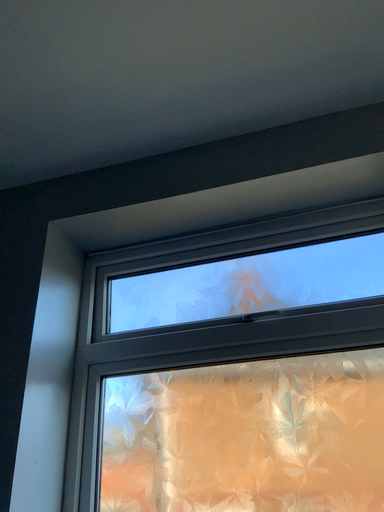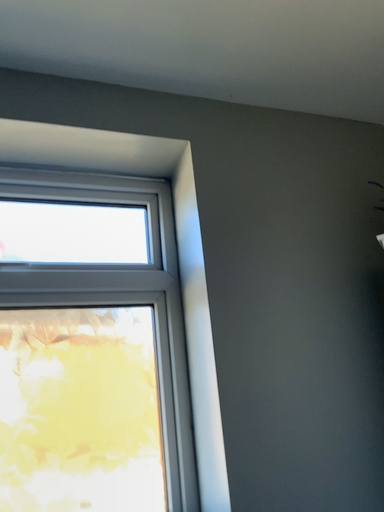
Question: Which way did the camera rotate in the video?

Choices:
 (A) rotated downward
 (B) rotated upward

Answer: (A)